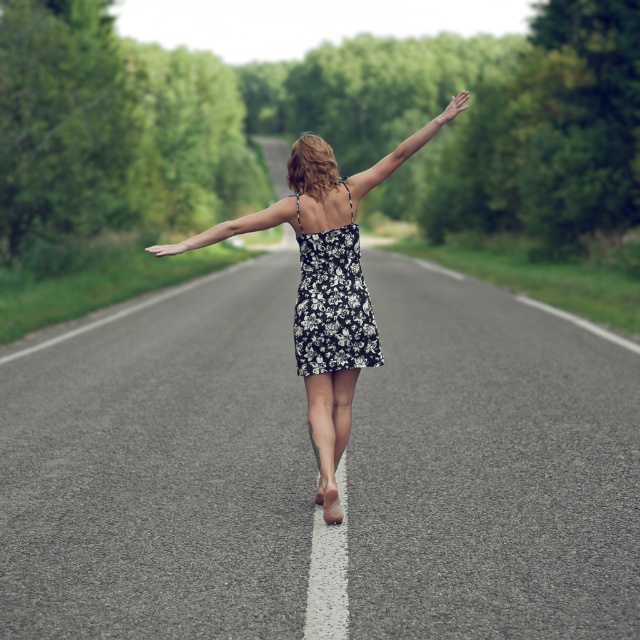
Question: Estimate the real-world distances between objects in this image. Which object is closer to the smooth skin hand at upper right?

Choices:
 (A) smooth skin arm at center
 (B) matte black arm at upper center

Answer: (B)

Question: Estimate the real-world distances between objects in this image. Which object is closer to the floral dress at center?

Choices:
 (A) smooth skin arm at center
 (B) floral-patterned fabric dress at center
 (C) matte black hand at center

Answer: (B)

Question: Does floral dress at center appear over matte black hand at center?

Choices:
 (A) no
 (B) yes

Answer: (A)

Question: Where is floral-patterned fabric dress at center located in relation to smooth skin hand at upper right in the image?

Choices:
 (A) above
 (B) below

Answer: (B)

Question: Is floral-patterned fabric dress at center bigger than smooth skin hand at upper right?

Choices:
 (A) yes
 (B) no

Answer: (A)

Question: Which object is closer to the camera taking this photo?

Choices:
 (A) smooth skin arm at center
 (B) matte black arm at upper center
 (C) floral-patterned fabric dress at center
 (D) floral dress at center

Answer: (D)